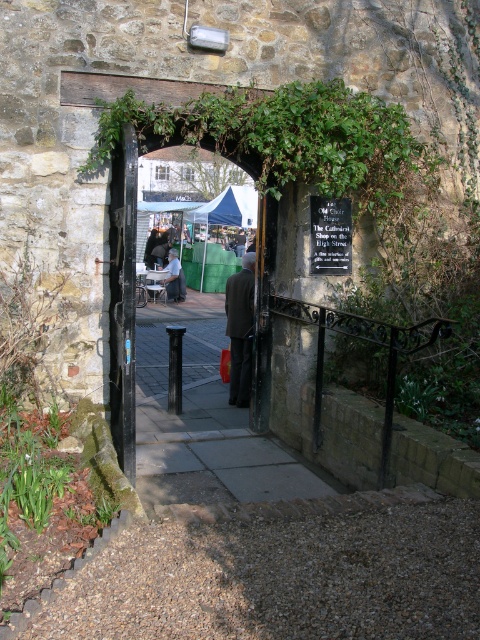
You are a delivery person standing in front of the stone archway. You need to deliver a package to the dark brown suit at center and the light blue denim jacket at center. Which one is closer to you?

The distance between the dark brown suit at center and the light blue denim jacket at center is 10.33 meters, so they are both equidistant from you since they are at the same central position.

You are standing in front of the stone archway and see the matte black door at center and the light blue denim jacket at center. Which object is closer to you?

The matte black door at center is closer to you because it is in front of the light blue denim jacket at center.

You are a delivery person carrying a light blue denim jacket at center and need to enter through the matte black door at center. Can you pass through the door without needing to adjust your position?

The matte black door at center is wider than the light blue denim jacket at center, so yes, you can pass through the door without needing to adjust your position.